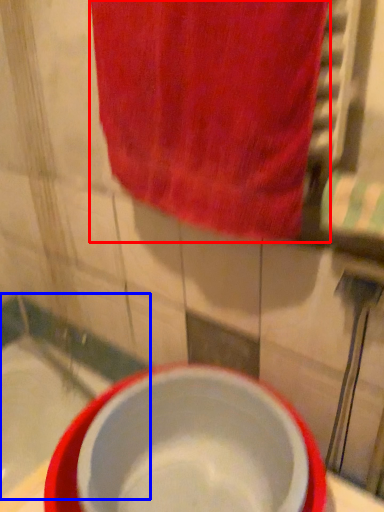
Question: Which object is further to the camera taking this photo, towel (highlighted by a red box) or bath (highlighted by a blue box)?

Choices:
 (A) towel
 (B) bath

Answer: (B)